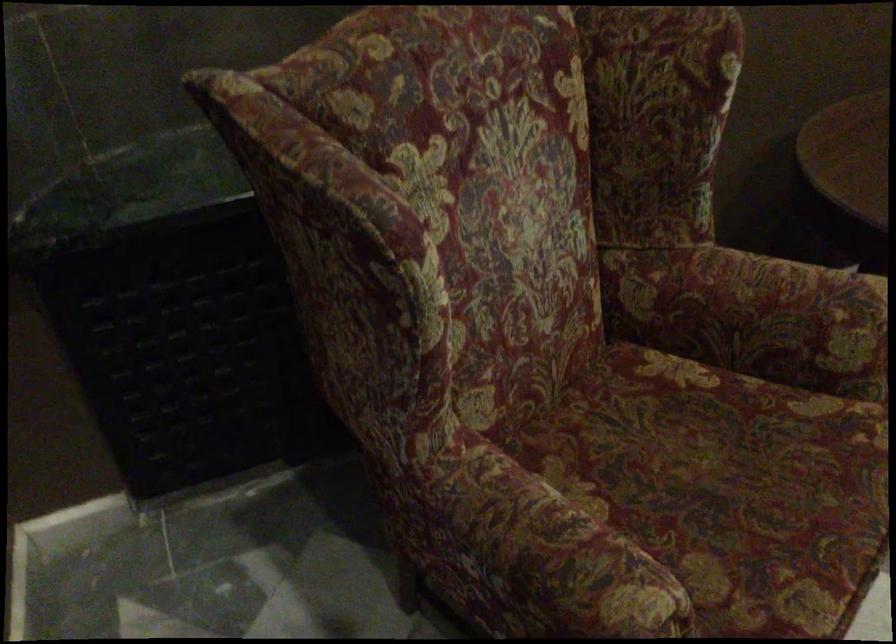
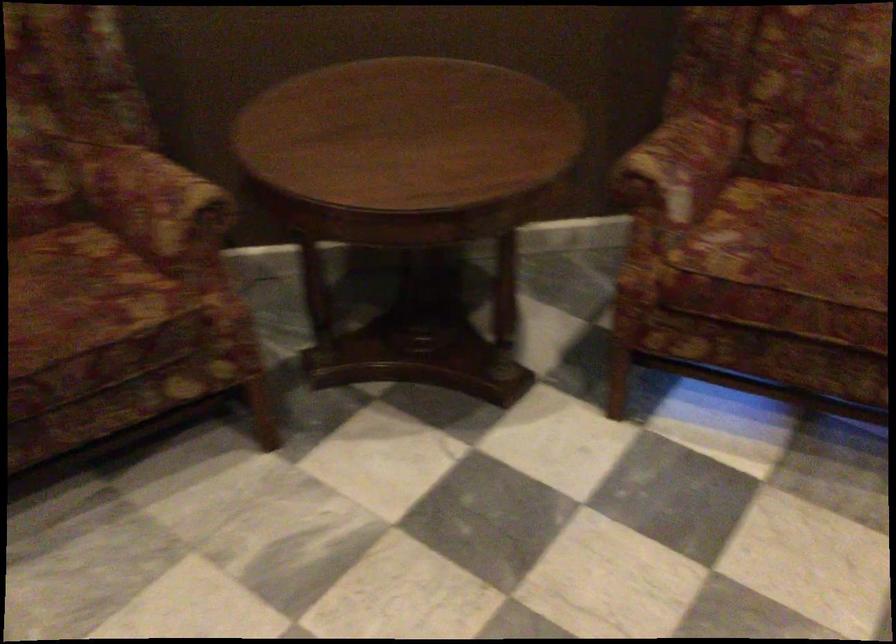
Question: Which direction would the cameraman need to move to produce the second image? Reply with the corresponding letter.

Choices:
 (A) Left
 (B) Right
 (C) Forward
 (D) Backward

Answer: (B)